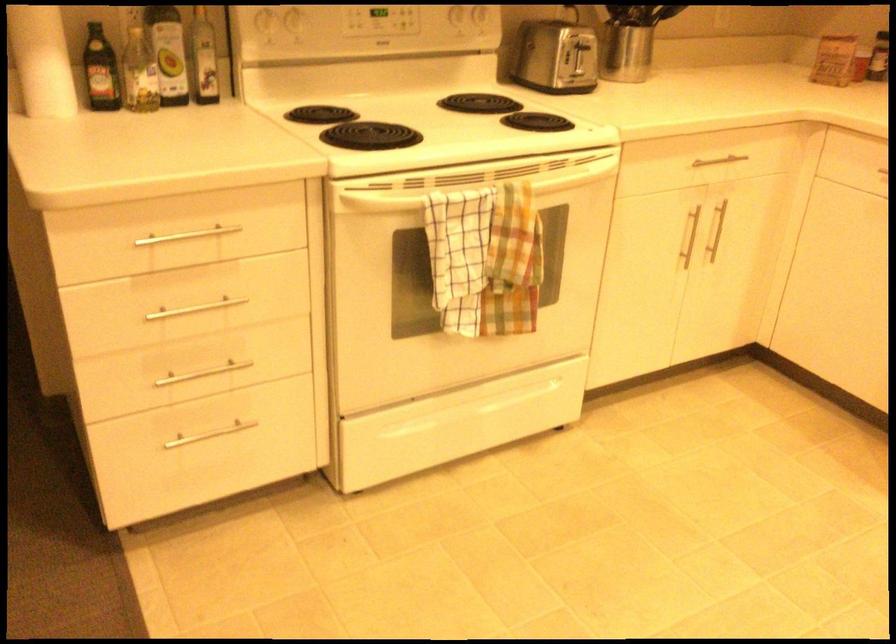
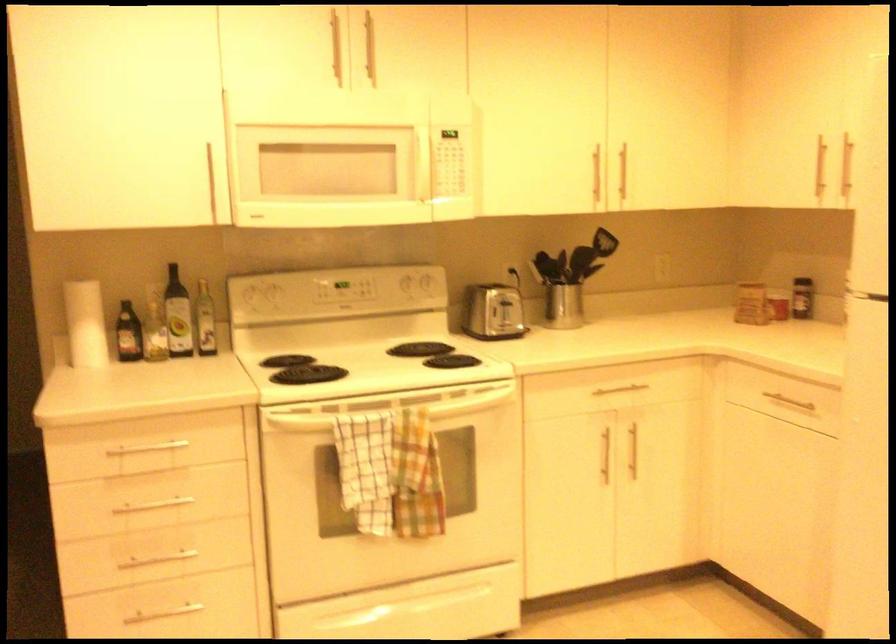
Question: The first image is from the beginning of the video and the second image is from the end. How did the camera likely rotate when shooting the video?

Choices:
 (A) Left
 (B) Right
 (C) Up
 (D) Down

Answer: (C)